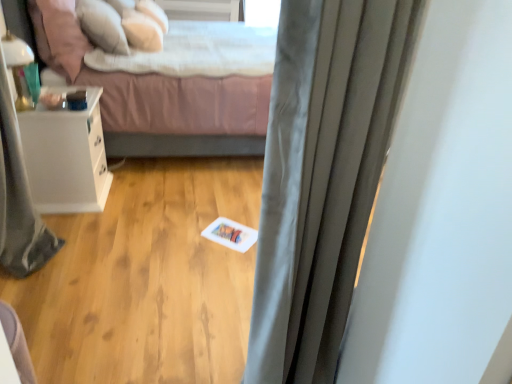
Locate an element on the screen. free point in front of white matte card at center is located at coordinates (221, 261).